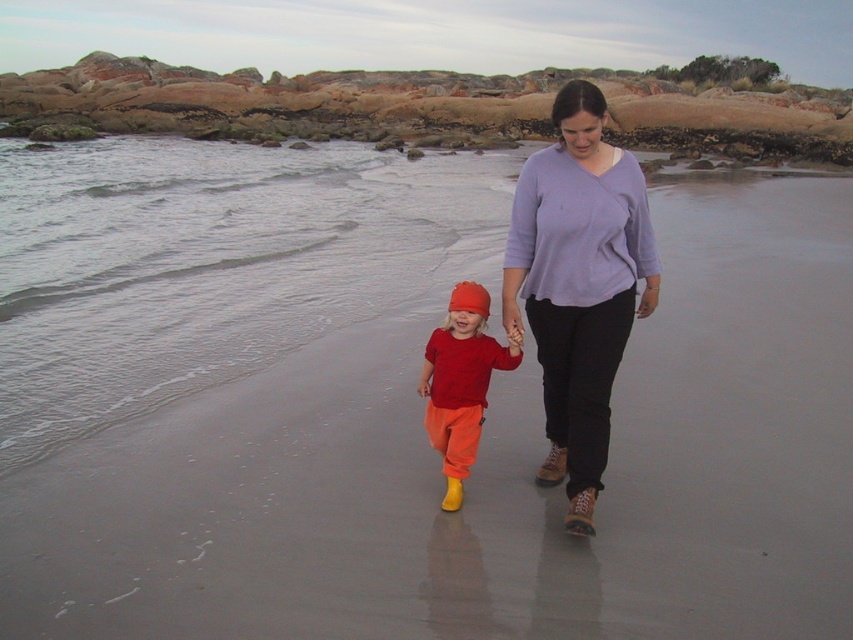
At what (x,y) coordinates should I click in order to perform the action: click on clear water at lower left. Please return your answer as a coordinate pair (x, y). Looking at the image, I should click on (209, 264).

Which is below, clear water at lower left or matte orange pants at center?

Positioned lower is matte orange pants at center.

Which is behind, point (42, 160) or point (450, 333)?

The point (42, 160) is behind.

At what (x,y) coordinates should I click in order to perform the action: click on clear water at lower left. Please return your answer as a coordinate pair (x, y). The image size is (853, 640). Looking at the image, I should click on (209, 264).

Between point (231, 273) and point (611, 228), which one is positioned behind?

Point (231, 273)

Does clear water at lower left appear on the right side of matte purple sweater at center?

Incorrect, clear water at lower left is not on the right side of matte purple sweater at center.

The width and height of the screenshot is (853, 640). What are the coordinates of `clear water at lower left` in the screenshot? It's located at (209, 264).

Is matte purple sweater at center closer to camera compared to matte orange pants at center?

No.

Locate an element on the screen. The image size is (853, 640). matte purple sweater at center is located at coordinates (578, 284).

What do you see at coordinates (578, 284) in the screenshot? I see `matte purple sweater at center` at bounding box center [578, 284].

At what (x,y) coordinates should I click in order to perform the action: click on matte purple sweater at center. Please return your answer as a coordinate pair (x, y). Image resolution: width=853 pixels, height=640 pixels. Looking at the image, I should click on (578, 284).